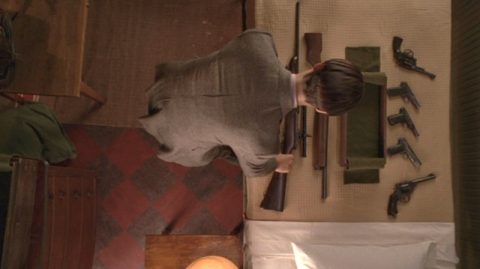
At what (x,y) coordinates should I click in order to perform the action: click on box. Please return your answer as a coordinate pair (x, y). The image size is (480, 269). Looking at the image, I should click on (367, 143).